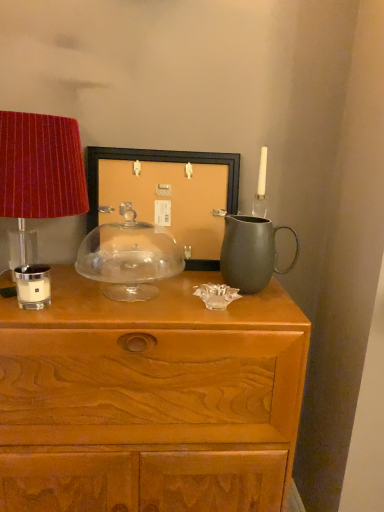
Question: Can you confirm if transparent glass cake stand at center, which is the 1th candle holder from right to left, is positioned to the left of velvet red lampshade at left?

Choices:
 (A) yes
 (B) no

Answer: (B)

Question: Can you confirm if transparent glass cake stand at center, arranged as the second candle holder when viewed from the left, is bigger than velvet red lampshade at left?

Choices:
 (A) no
 (B) yes

Answer: (A)

Question: Is transparent glass cake stand at center, arranged as the second candle holder when viewed from the left, smaller than velvet red lampshade at left?

Choices:
 (A) no
 (B) yes

Answer: (B)

Question: Can velvet red lampshade at left be found inside transparent glass cake stand at center, which is the 1th candle holder from right to left?

Choices:
 (A) yes
 (B) no

Answer: (B)

Question: From a real-world perspective, is transparent glass cake stand at center, arranged as the second candle holder when viewed from the left, over velvet red lampshade at left?

Choices:
 (A) no
 (B) yes

Answer: (A)

Question: From the image's perspective, does transparent glass cake stand at center, arranged as the second candle holder when viewed from the left, appear lower than velvet red lampshade at left?

Choices:
 (A) yes
 (B) no

Answer: (A)

Question: From a real-world perspective, is wooden chest of drawers at center physically above velvet red lampshade at left?

Choices:
 (A) no
 (B) yes

Answer: (A)

Question: Is wooden chest of drawers at center oriented away from velvet red lampshade at left?

Choices:
 (A) no
 (B) yes

Answer: (A)

Question: Is the position of wooden chest of drawers at center more distant than that of velvet red lampshade at left?

Choices:
 (A) yes
 (B) no

Answer: (B)

Question: Considering the relative sizes of wooden chest of drawers at center and velvet red lampshade at left in the image provided, is wooden chest of drawers at center taller than velvet red lampshade at left?

Choices:
 (A) yes
 (B) no

Answer: (A)

Question: Considering the relative sizes of wooden chest of drawers at center and velvet red lampshade at left in the image provided, is wooden chest of drawers at center smaller than velvet red lampshade at left?

Choices:
 (A) no
 (B) yes

Answer: (A)

Question: Is wooden chest of drawers at center to the right of velvet red lampshade at left from the viewer's perspective?

Choices:
 (A) yes
 (B) no

Answer: (A)

Question: Considering the relative sizes of transparent glass cake stand at center, which is the 1th candle holder from right to left, and matte black picture frame at center in the image provided, is transparent glass cake stand at center, which is the 1th candle holder from right to left, wider than matte black picture frame at center?

Choices:
 (A) no
 (B) yes

Answer: (B)